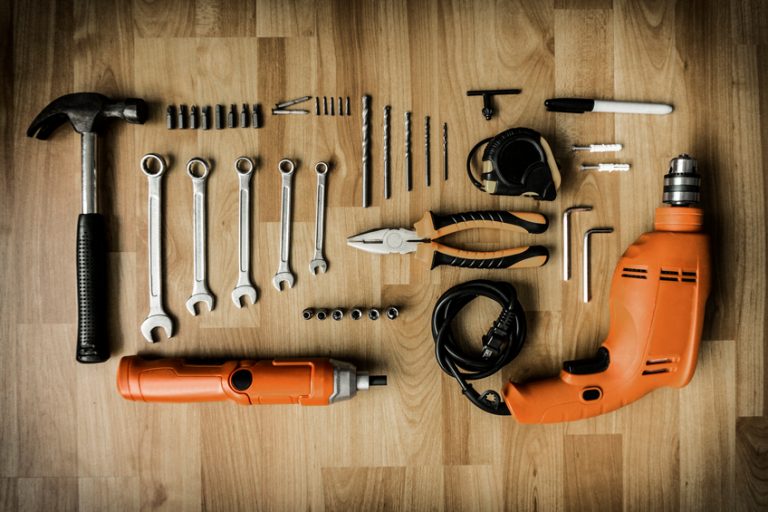
Identify the location of socket piece. This screenshot has width=768, height=512. (394, 308), (373, 313), (353, 314), (336, 314), (319, 316), (305, 316).